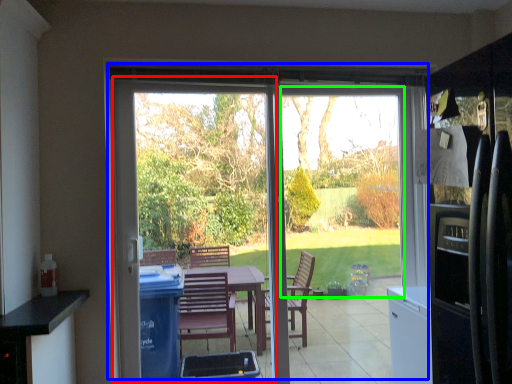
Question: Which object is positioned farthest from screen door (highlighted by a red box)? Select from door (highlighted by a blue box) and window screen (highlighted by a green box).

Choices:
 (A) door
 (B) window screen

Answer: (B)